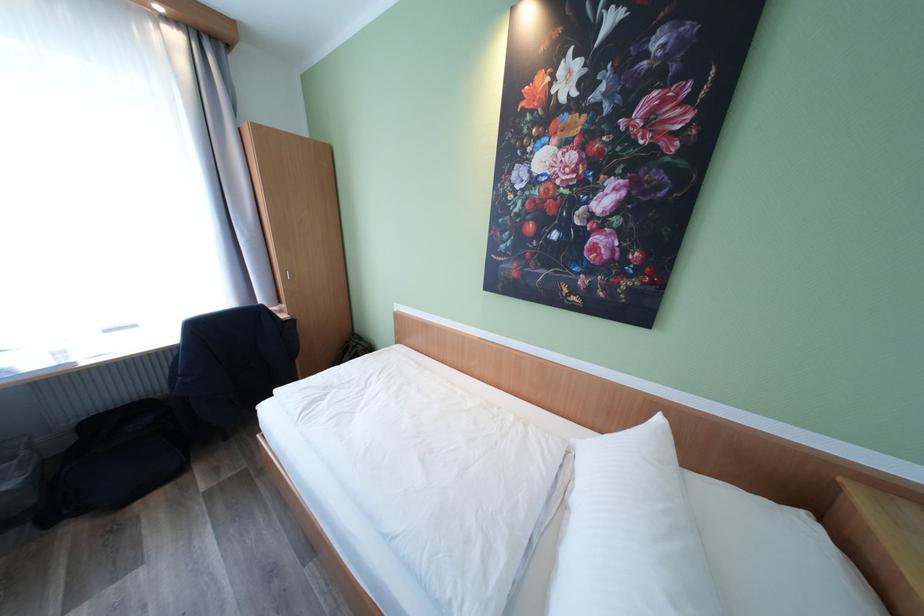
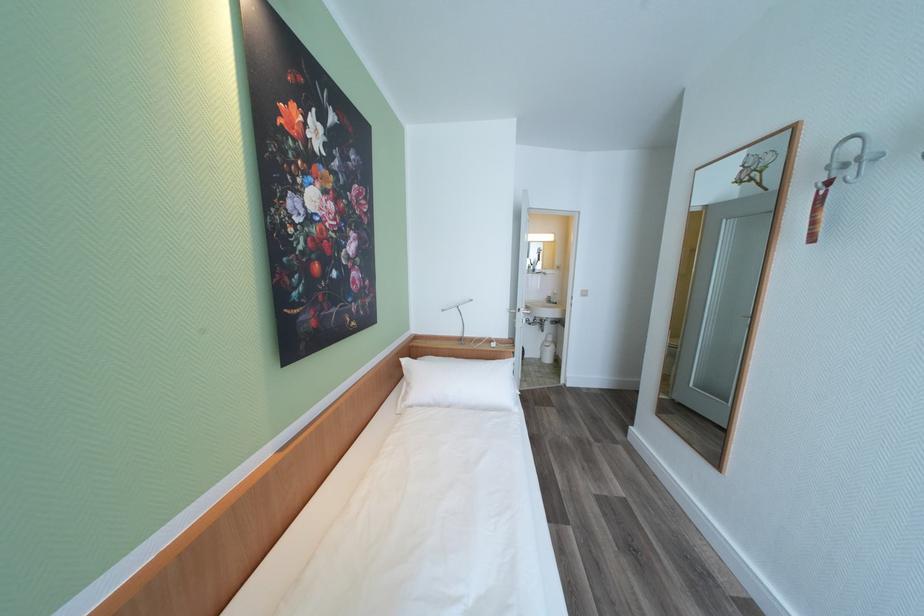
The point at [666,422] is marked in the first image. Where is the corresponding point in the second image?

(411, 362)